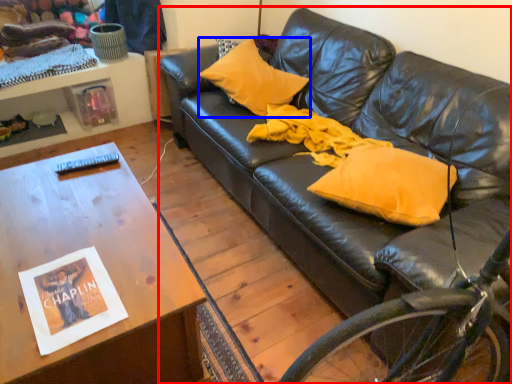
Question: Which of the following is the closest to the observer, studio couch (highlighted by a red box) or pillow (highlighted by a blue box)?

Choices:
 (A) studio couch
 (B) pillow

Answer: (A)